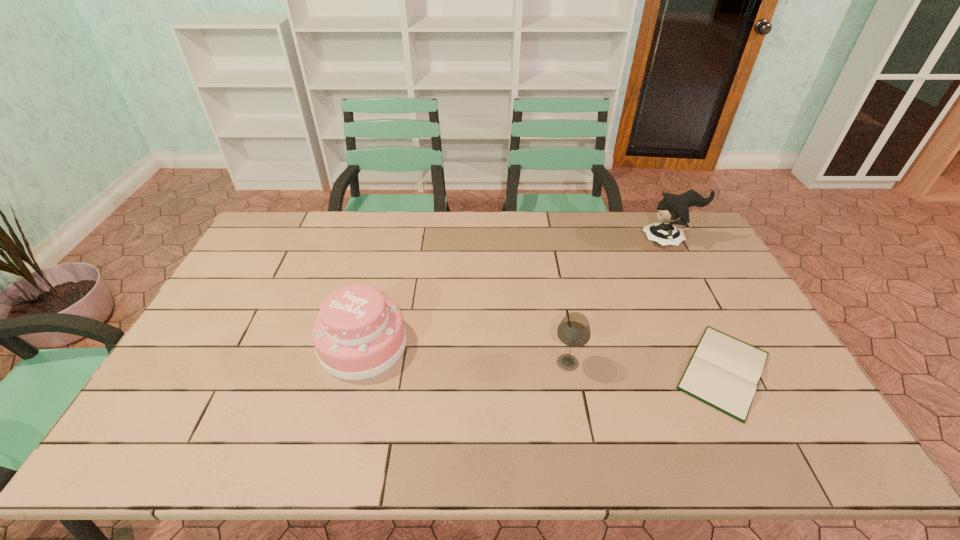
This screenshot has width=960, height=540. In order to click on free spot located on the back of the shortest object in this screenshot , I will do `click(673, 269)`.

You are a GUI agent. You are given a task and a screenshot of the screen. Output one action in this format:
    pyautogui.click(x=<x>, y=<y>)
    Task: Click on the object positioned at the far edge
    The height and width of the screenshot is (540, 960).
    Given the screenshot: What is the action you would take?
    pyautogui.click(x=674, y=209)

Locate an element on the screen. Image resolution: width=960 pixels, height=540 pixels. doll present at the right edge is located at coordinates (674, 209).

This screenshot has height=540, width=960. I want to click on hardback book that is at the right edge, so click(724, 372).

Locate an element on the screen. The width and height of the screenshot is (960, 540). object at the far right corner is located at coordinates (674, 209).

The width and height of the screenshot is (960, 540). In the image, there is a desktop. Find the location of `free space at the far edge`. free space at the far edge is located at coordinates (483, 216).

At what (x,y) coordinates should I click in order to perform the action: click on vacant space at the near edge of the desktop. Please return your answer as a coordinate pair (x, y). This screenshot has height=540, width=960. Looking at the image, I should click on (612, 436).

At what (x,y) coordinates should I click in order to perform the action: click on vacant space at the right edge. Please return your answer as a coordinate pair (x, y). This screenshot has height=540, width=960. Looking at the image, I should click on (698, 307).

Locate an element on the screen. empty location between the birthday cake and the farthest object is located at coordinates (516, 293).

This screenshot has height=540, width=960. What are the coordinates of `vacant point located between the tallest object and the wineglass` in the screenshot? It's located at (618, 302).